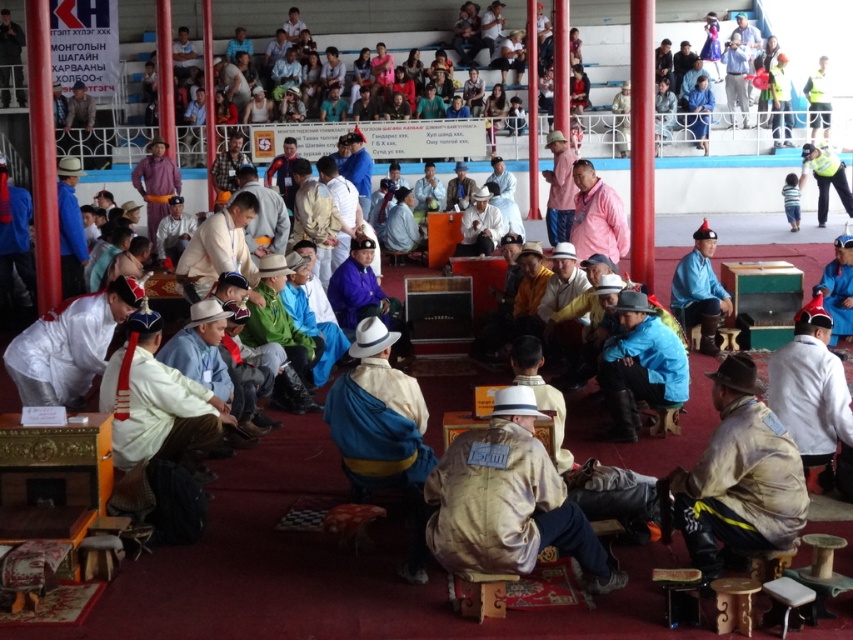
Question: Which object appears farthest from the camera in this image?

Choices:
 (A) camouflage fabric jacket at center
 (B) matte blue jacket at left
 (C) white silk hat at center
 (D) blue fabric hat at center

Answer: (B)

Question: Estimate the real-world distances between objects in this image. Which object is closer to the matte blue jacket at left?

Choices:
 (A) tan suede jacket at center
 (B) blue fabric hat at center

Answer: (B)

Question: Is white matte hat at center bigger than matte blue jacket at left?

Choices:
 (A) no
 (B) yes

Answer: (A)

Question: Which object appears closest to the camera in this image?

Choices:
 (A) blue fabric hat at center
 (B) white cotton shirt at center
 (C) white matte hat at center
 (D) camouflage fabric jacket at center

Answer: (D)

Question: Is white silk hat at center wider than matte blue jacket at left?

Choices:
 (A) no
 (B) yes

Answer: (B)

Question: Does tan suede jacket at center have a lesser width compared to white matte hat at center?

Choices:
 (A) no
 (B) yes

Answer: (A)